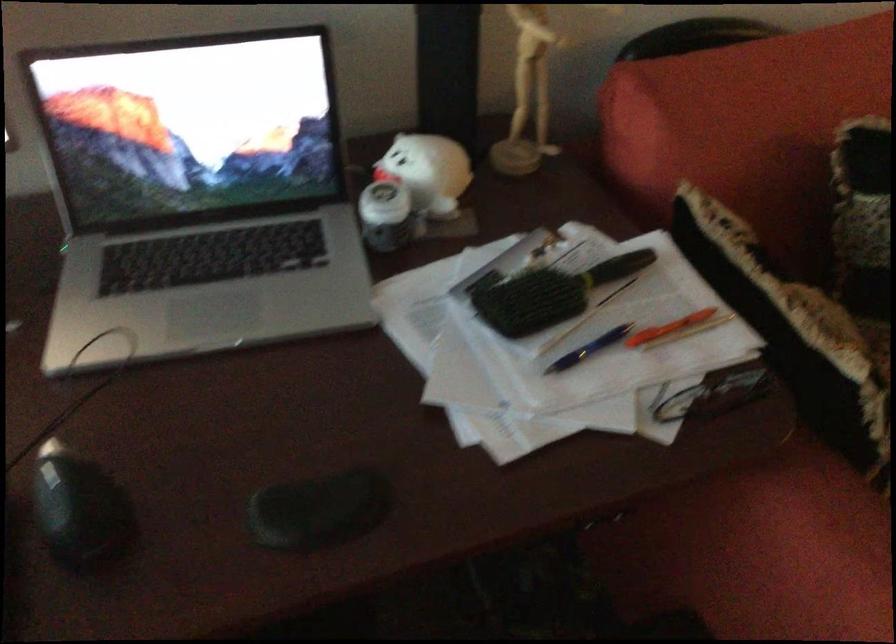
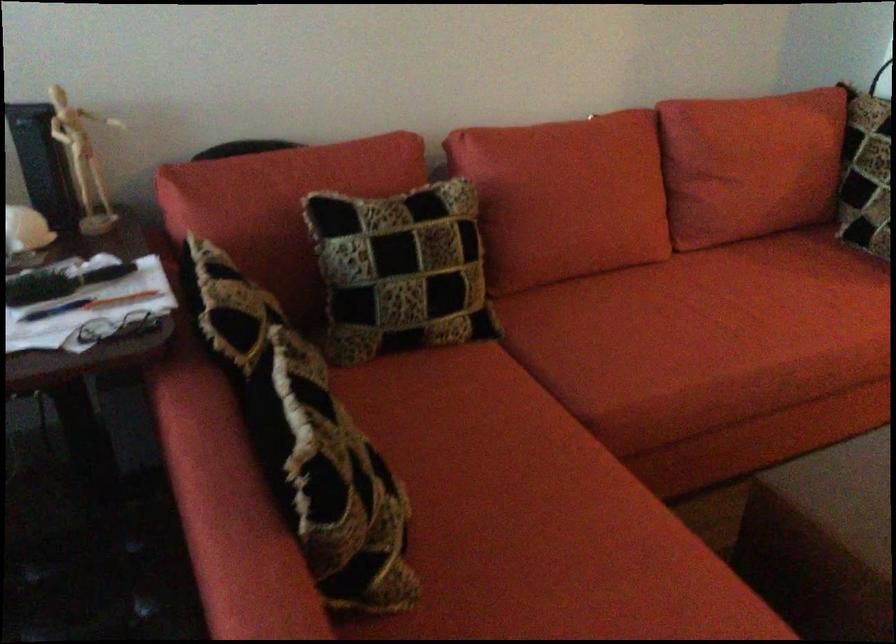
In the second image, find the point that corresponds to point 686,368 in the first image.

(119, 328)